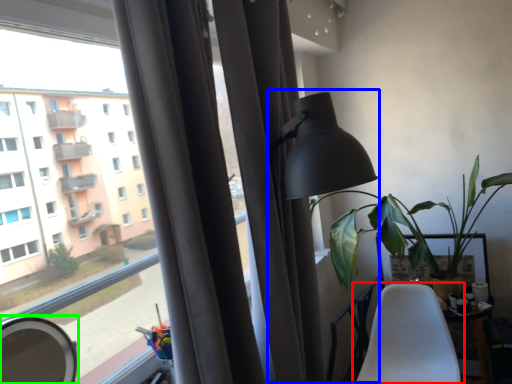
Question: Which object is positioned closest to chair (highlighted by a red box)? Select from table lamp (highlighted by a blue box) and mirror (highlighted by a green box).

Choices:
 (A) table lamp
 (B) mirror

Answer: (A)